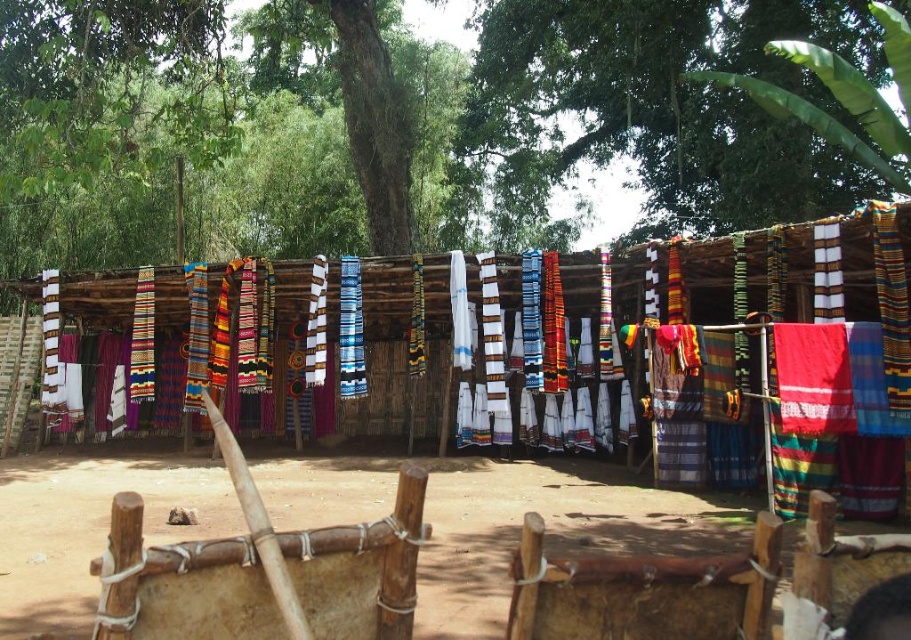
You are an anthropologist studying the textiles in this rural area. You notice a specific point in the image at coordinates point [763,349]. What object is located at this point?

The textured woven cloth at center is located at point [763,349].

You are standing at the entrance of the rustic outdoor setting and want to hang a new flag between the textured woven cloth at center and the wooden huts. The flag requires 6 meters of space between the cloth and the huts to be properly displayed. Is there enough space?

The distance between the textured woven cloth at center and the wooden huts is 5.59 meters. Since the flag requires 6 meters of space, there is not enough space to properly display it.

Looking at this image, you are standing at the edge of the rustic outdoor setting and want to locate the brown dirt field at center. According to the coordinates provided, where exactly would you find it?

The brown dirt field at center is located at the coordinates point (499, 520).